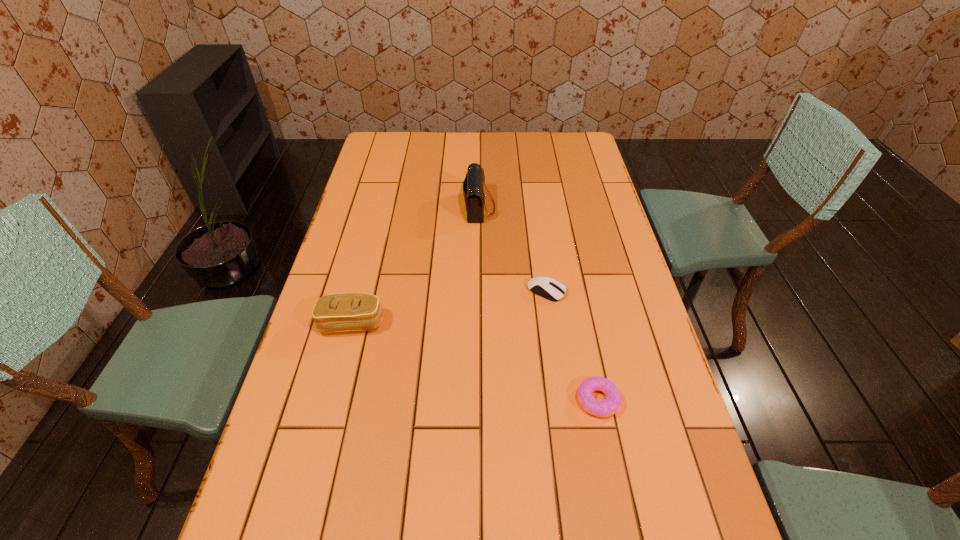
Where is `object located at the left edge`? The width and height of the screenshot is (960, 540). object located at the left edge is located at coordinates (339, 312).

The width and height of the screenshot is (960, 540). Identify the location of object present at the right edge. (605, 408).

The image size is (960, 540). What are the coordinates of `free space at the far edge` in the screenshot? It's located at (472, 151).

The width and height of the screenshot is (960, 540). I want to click on free region at the left edge of the desktop, so click(310, 367).

Image resolution: width=960 pixels, height=540 pixels. What are the coordinates of `free space at the right edge of the desktop` in the screenshot? It's located at (584, 201).

Where is `vacant space at the far left corner`? vacant space at the far left corner is located at coordinates (396, 134).

The image size is (960, 540). I want to click on blank space at the far right corner of the desktop, so coord(587,141).

Where is `vacant area between the tallest object and the nearest object`? vacant area between the tallest object and the nearest object is located at coordinates (x=539, y=303).

The width and height of the screenshot is (960, 540). What are the coordinates of `blank region between the third shortest object and the doughnut` in the screenshot? It's located at (475, 362).

Identify the location of free space between the leftmost object and the mouse. The width and height of the screenshot is (960, 540). (449, 307).